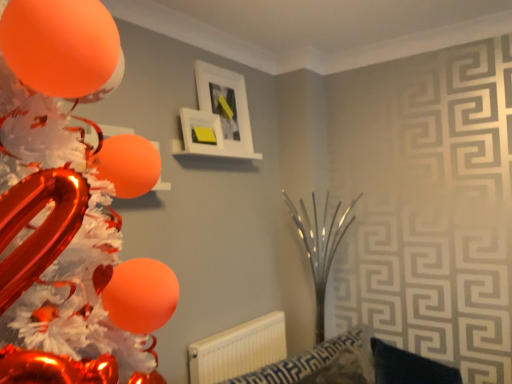
Question: Considering the relative sizes of white matte picture frame at upper center, the first picture frame viewed from the front, and orange glossy balloon at left in the image provided, is white matte picture frame at upper center, the first picture frame viewed from the front, bigger than orange glossy balloon at left?

Choices:
 (A) no
 (B) yes

Answer: (A)

Question: Is white matte picture frame at upper center, the 2th picture frame in the back-to-front sequence, to the left of orange glossy balloon at left from the viewer's perspective?

Choices:
 (A) no
 (B) yes

Answer: (A)

Question: From the image's perspective, is white matte picture frame at upper center, the 2th picture frame in the back-to-front sequence, below orange glossy balloon at left?

Choices:
 (A) no
 (B) yes

Answer: (A)

Question: Is white matte picture frame at upper center, the first picture frame viewed from the front, taller than orange glossy balloon at left?

Choices:
 (A) no
 (B) yes

Answer: (A)

Question: Is white matte picture frame at upper center, the first picture frame viewed from the front, wider than orange glossy balloon at left?

Choices:
 (A) no
 (B) yes

Answer: (A)

Question: Is white matte picture frame at upper center, the 2th picture frame in the back-to-front sequence, in front of orange glossy balloon at left?

Choices:
 (A) yes
 (B) no

Answer: (B)

Question: Is white matte picture frame at upper center, positioned as the 2th picture frame in front-to-back order, outside orange glossy balloon at left?

Choices:
 (A) no
 (B) yes

Answer: (B)

Question: Are white matte picture frame at upper center, positioned as the 2th picture frame in front-to-back order, and orange glossy balloon at left far apart?

Choices:
 (A) no
 (B) yes

Answer: (B)

Question: Does white matte picture frame at upper center, positioned as the 2th picture frame in front-to-back order, have a lesser height compared to orange glossy balloon at left?

Choices:
 (A) yes
 (B) no

Answer: (A)

Question: Could you tell me if white matte picture frame at upper center, which is counted as the first picture frame, starting from the back, is facing orange glossy balloon at left?

Choices:
 (A) no
 (B) yes

Answer: (A)

Question: Is white matte picture frame at upper center, positioned as the 2th picture frame in front-to-back order, smaller than orange glossy balloon at left?

Choices:
 (A) yes
 (B) no

Answer: (A)

Question: Is the position of white matte picture frame at upper center, positioned as the 2th picture frame in front-to-back order, less distant than that of orange glossy balloon at left?

Choices:
 (A) no
 (B) yes

Answer: (A)

Question: Considering the relative sizes of orange glossy balloon at left and white plastic radiator at lower center in the image provided, is orange glossy balloon at left shorter than white plastic radiator at lower center?

Choices:
 (A) yes
 (B) no

Answer: (B)